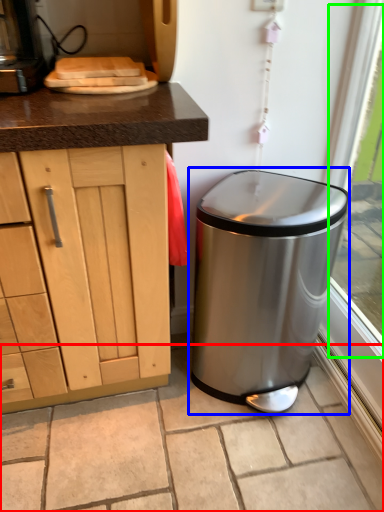
Question: Based on their relative distances, which object is farther from granite (highlighted by a red box)? Choose from waste container (highlighted by a blue box) and window screen (highlighted by a green box).

Choices:
 (A) waste container
 (B) window screen

Answer: (B)